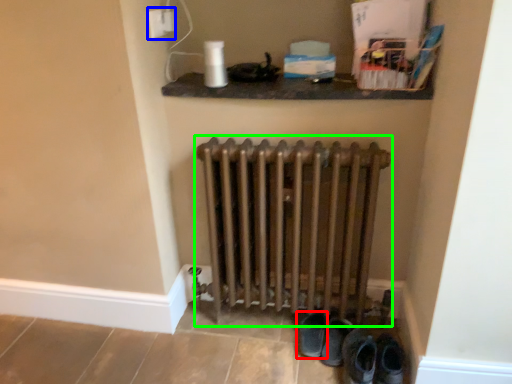
Question: Which is nearer to the footwear (highlighted by a red box)? electric outlet (highlighted by a blue box) or radiator (highlighted by a green box).

Choices:
 (A) electric outlet
 (B) radiator

Answer: (B)